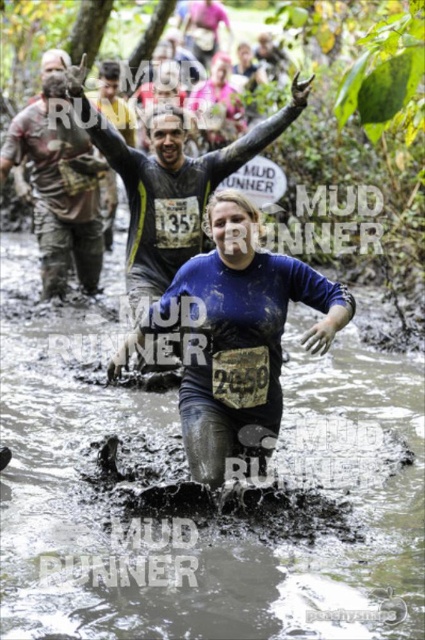
Question: From the image, what is the correct spatial relationship of muddy water at center in relation to blue fabric shirt at center?

Choices:
 (A) left
 (B) right

Answer: (A)

Question: Which point is farther to the camera?

Choices:
 (A) blue matte shirt at center
 (B) muddy water at center
 (C) blue cotton shirt at center

Answer: (A)

Question: Which object is closer to the camera taking this photo?

Choices:
 (A) blue cotton shirt at center
 (B) muddy water at center
 (C) blue matte shirt at center
 (D) blue fabric shirt at center

Answer: (B)

Question: Which of the following is the closest to the observer?

Choices:
 (A) (229, 244)
 (B) (79, 96)

Answer: (A)

Question: Can you confirm if muddy water at center is positioned to the left of blue fabric shirt at center?

Choices:
 (A) no
 (B) yes

Answer: (B)

Question: Is blue cotton shirt at center below blue fabric shirt at center?

Choices:
 (A) yes
 (B) no

Answer: (A)